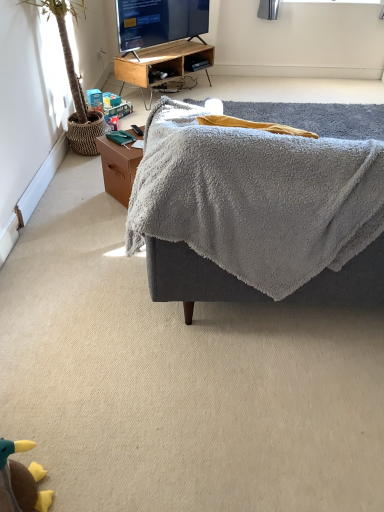
Where is `matte black tv at upper center`? matte black tv at upper center is located at coordinates (159, 22).

The height and width of the screenshot is (512, 384). Find the location of `green leafy plant at left`. green leafy plant at left is located at coordinates (74, 80).

Measure the distance between green leafy plant at left and camera.

green leafy plant at left is 7.72 feet away from camera.

What are the coordinates of `plush yellow duck at lower left` in the screenshot? It's located at (21, 481).

The image size is (384, 512). I want to click on toy below the gray fuzzy ottoman at center (from a real-world perspective), so click(x=21, y=481).

Considering their positions, is plush yellow duck at lower left located in front of or behind gray fuzzy ottoman at center?

plush yellow duck at lower left is in front of gray fuzzy ottoman at center.

Is point (45, 473) farther from camera compared to point (180, 219)?

No.

Does plush yellow duck at lower left have a lesser height compared to gray fuzzy ottoman at center?

Yes.

Can you confirm if gray fuzzy ottoman at center is thinner than woodendesk at upper center?

In fact, gray fuzzy ottoman at center might be wider than woodendesk at upper center.

From the image's perspective, is gray fuzzy ottoman at center on top of woodendesk at upper center?

No.

Which object is more forward, gray fuzzy ottoman at center or woodendesk at upper center?

gray fuzzy ottoman at center is more forward.

From the picture: From a real-world perspective, which is physically below, gray fuzzy ottoman at center or woodendesk at upper center?

From a 3D spatial view, woodendesk at upper center is below.

You are a GUI agent. You are given a task and a screenshot of the screen. Output one action in this format:
    pyautogui.click(x=<x>, y=<y>)
    Task: Click on the television behind the gray fuzzy ottoman at center
    Image resolution: width=384 pixels, height=512 pixels.
    Given the screenshot: What is the action you would take?
    pyautogui.click(x=159, y=22)

Can you confirm if gray fuzzy ottoman at center is positioned to the left of matte black tv at upper center?

In fact, gray fuzzy ottoman at center is to the right of matte black tv at upper center.

Which point is more distant from viewer, (x=209, y=217) or (x=173, y=35)?

Positioned behind is point (x=173, y=35).

From their relative heights in the image, would you say gray fuzzy ottoman at center is taller or shorter than matte black tv at upper center?

gray fuzzy ottoman at center is taller than matte black tv at upper center.

You are a GUI agent. You are given a task and a screenshot of the screen. Output one action in this format:
    pyautogui.click(x=<x>, y=<y>)
    Task: Click on the furniture that is above the woodendesk at upper center (from a real-world perspective)
    This screenshot has width=384, height=512.
    Given the screenshot: What is the action you would take?
    pyautogui.click(x=258, y=214)

Who is taller, woodendesk at upper center or gray fuzzy ottoman at center?

gray fuzzy ottoman at center is taller.

Which is in front, point (154, 67) or point (323, 220)?

The point (323, 220) is more forward.

Considering the sizes of woodendesk at upper center and gray fuzzy ottoman at center in the image, is woodendesk at upper center wider or thinner than gray fuzzy ottoman at center?

Clearly, woodendesk at upper center has less width compared to gray fuzzy ottoman at center.

Can you tell me how much matte black tv at upper center and plush yellow duck at lower left differ in facing direction?

They differ by 64 degrees in their facing directions.

Are matte black tv at upper center and plush yellow duck at lower left located far from each other?

Yes.

From the image's perspective, which is below, matte black tv at upper center or plush yellow duck at lower left?

plush yellow duck at lower left appears lower in the image.

Considering the sizes of objects green leafy plant at left and brown wooden side table at lower left in the image provided, who is thinner, green leafy plant at left or brown wooden side table at lower left?

brown wooden side table at lower left.

From a real-world perspective, is green leafy plant at left physically located above or below brown wooden side table at lower left?

Clearly, from a real-world perspective, green leafy plant at left is above brown wooden side table at lower left.

From the image's perspective, relative to brown wooden side table at lower left, is green leafy plant at left above or below?

From the image's perspective, green leafy plant at left appears above brown wooden side table at lower left.

How much distance is there between plush yellow duck at lower left and green leafy plant at left?

A distance of 2.21 meters exists between plush yellow duck at lower left and green leafy plant at left.

Which is less distant, (21,503) or (84,16)?

Point (21,503).

Find the location of a particular element. toy on the right of green leafy plant at left is located at coordinates (21, 481).

Looking at this image, is plush yellow duck at lower left far away from green leafy plant at left?

Indeed, plush yellow duck at lower left is not near green leafy plant at left.

This screenshot has height=512, width=384. In the image, there is a gray fuzzy ottoman at center. In order to click on toy below it (from a real-world perspective) in this screenshot , I will do `click(21, 481)`.

Identify the location of furniture on the right side of woodendesk at upper center. (258, 214).

Which object lies further to the anchor point brown wooden side table at lower left, matte black tv at upper center or green leafy plant at left?

matte black tv at upper center.

Consider the image. Based on their spatial positions, is brown wooden side table at lower left or woodendesk at upper center further from matte black tv at upper center?

Among the two, brown wooden side table at lower left is located further to matte black tv at upper center.

Estimate the real-world distances between objects in this image. Which object is closer to gray fuzzy ottoman at center, plush yellow duck at lower left or woodendesk at upper center?

Based on the image, plush yellow duck at lower left appears to be nearer to gray fuzzy ottoman at center.

From the image, which object appears to be nearer to matte black tv at upper center, woodendesk at upper center or brown wooden side table at lower left?

Among the two, woodendesk at upper center is located nearer to matte black tv at upper center.

Based on their spatial positions, is woodendesk at upper center or brown wooden side table at lower left further from plush yellow duck at lower left?

The object further to plush yellow duck at lower left is woodendesk at upper center.

Based on their spatial positions, is green leafy plant at left or brown wooden side table at lower left closer to woodendesk at upper center?

Among the two, green leafy plant at left is located nearer to woodendesk at upper center.

Which object lies further to the anchor point brown wooden side table at lower left, woodendesk at upper center or gray fuzzy ottoman at center?

Based on the image, woodendesk at upper center appears to be further to brown wooden side table at lower left.

Which object lies further to the anchor point plush yellow duck at lower left, gray fuzzy ottoman at center or woodendesk at upper center?

woodendesk at upper center is positioned further to the anchor plush yellow duck at lower left.

I want to click on houseplant between plush yellow duck at lower left and woodendesk at upper center along the z-axis, so click(74, 80).

At what (x,y) coordinates should I click in order to perform the action: click on table between green leafy plant at left and woodendesk at upper center from front to back. Please return your answer as a coordinate pair (x, y). The width and height of the screenshot is (384, 512). Looking at the image, I should click on (118, 168).

Identify the location of television between gray fuzzy ottoman at center and woodendesk at upper center along the z-axis. The height and width of the screenshot is (512, 384). (159, 22).

Identify the location of houseplant between matte black tv at upper center and brown wooden side table at lower left from top to bottom. The image size is (384, 512). (74, 80).